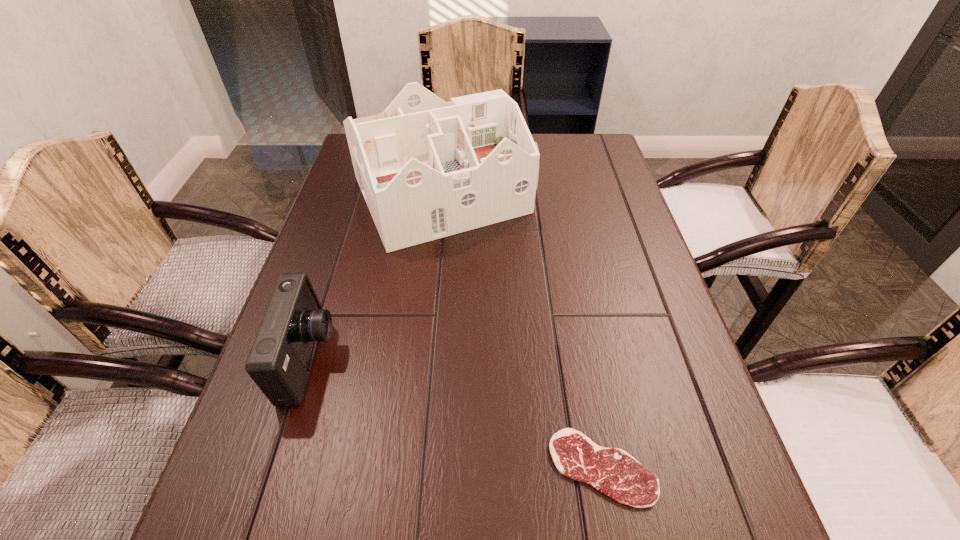
Locate an element on the screen. free point that satisfies the following two spatial constraints: 1. on the front-facing side of the second tallest object; 2. on the back side of the steak is located at coordinates (276, 467).

The width and height of the screenshot is (960, 540). Identify the location of free space that satisfies the following two spatial constraints: 1. on the front side of the steak; 2. on the left side of the dollhouse. (416, 467).

The image size is (960, 540). I want to click on vacant space that satisfies the following two spatial constraints: 1. on the front side of the tallest object; 2. on the front-facing side of the second tallest object, so click(426, 360).

This screenshot has height=540, width=960. I want to click on vacant space that satisfies the following two spatial constraints: 1. on the front side of the farthest object; 2. on the front-facing side of the second shortest object, so click(x=426, y=360).

This screenshot has height=540, width=960. What are the coordinates of `free space in the image that satisfies the following two spatial constraints: 1. on the front-facing side of the camera; 2. on the right side of the nearest object` in the screenshot? It's located at click(276, 467).

Where is `free space that satisfies the following two spatial constraints: 1. on the front-facing side of the steak; 2. on the right side of the second tallest object`? This screenshot has height=540, width=960. free space that satisfies the following two spatial constraints: 1. on the front-facing side of the steak; 2. on the right side of the second tallest object is located at coordinates (276, 467).

Locate an element on the screen. The width and height of the screenshot is (960, 540). free spot that satisfies the following two spatial constraints: 1. on the front-facing side of the nearest object; 2. on the right side of the second farthest object is located at coordinates (276, 467).

Where is `vacant point that satisfies the following two spatial constraints: 1. on the front-facing side of the second tallest object; 2. on the left side of the shortest object`? vacant point that satisfies the following two spatial constraints: 1. on the front-facing side of the second tallest object; 2. on the left side of the shortest object is located at coordinates (276, 467).

At what (x,y) coordinates should I click in order to perform the action: click on vacant space that satisfies the following two spatial constraints: 1. on the back side of the steak; 2. on the front-facing side of the second nearest object. Please return your answer as a coordinate pair (x, y). The height and width of the screenshot is (540, 960). Looking at the image, I should click on (582, 360).